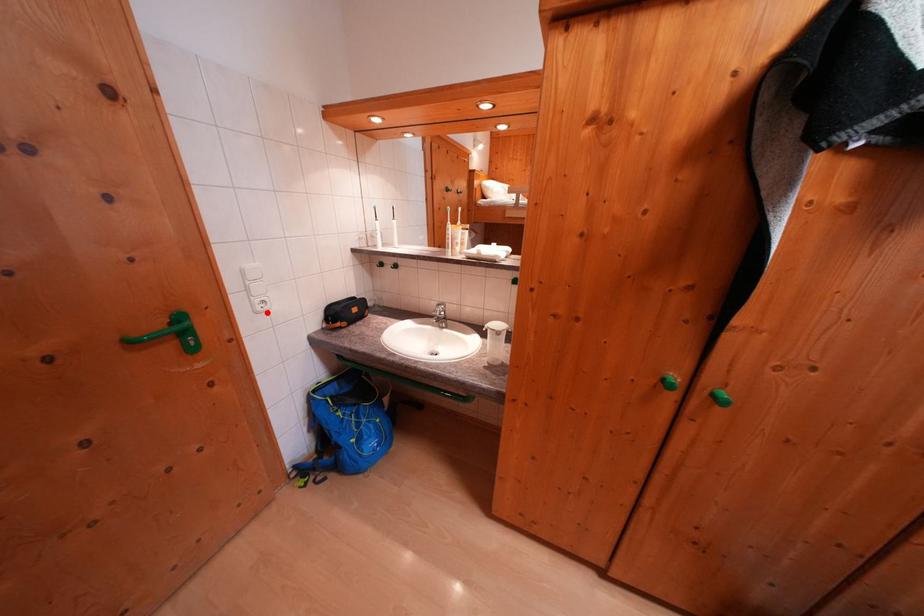
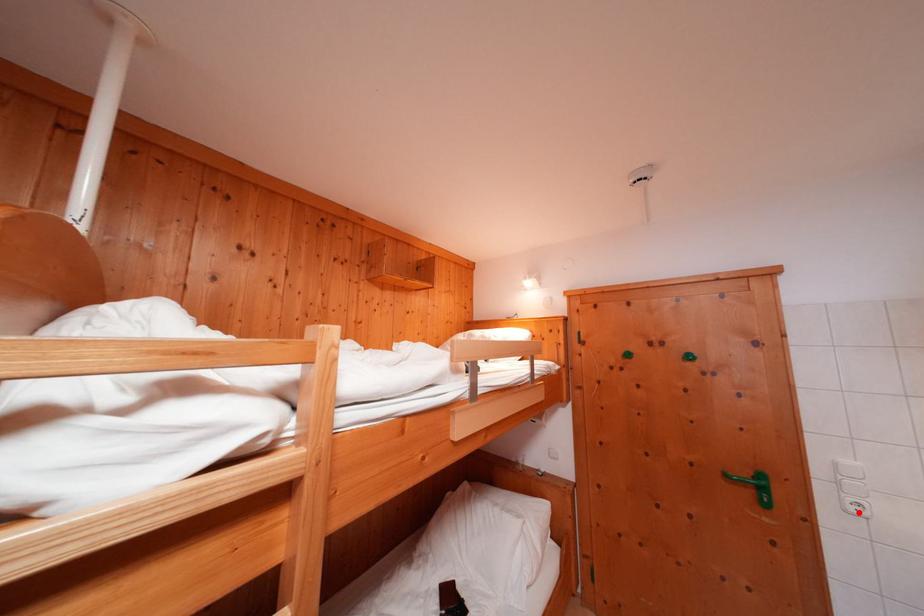
I am providing you with two images of the same scene from different viewpoints. A red point is marked on the first image and another point is marked on the second image. Do the highlighted points in image1 and image2 indicate the same real-world spot?

Yes